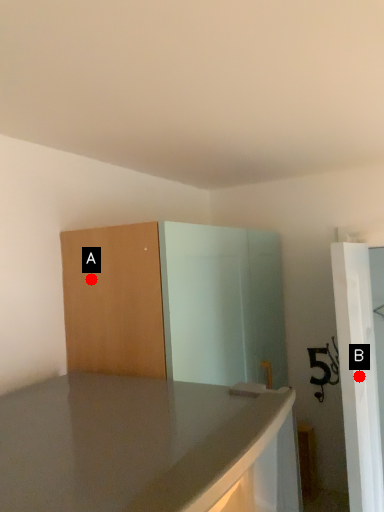
Question: Two points are circled on the image, labeled by A and B beside each circle. Which point is farther to the camera?

Choices:
 (A) A is further
 (B) B is further

Answer: (B)